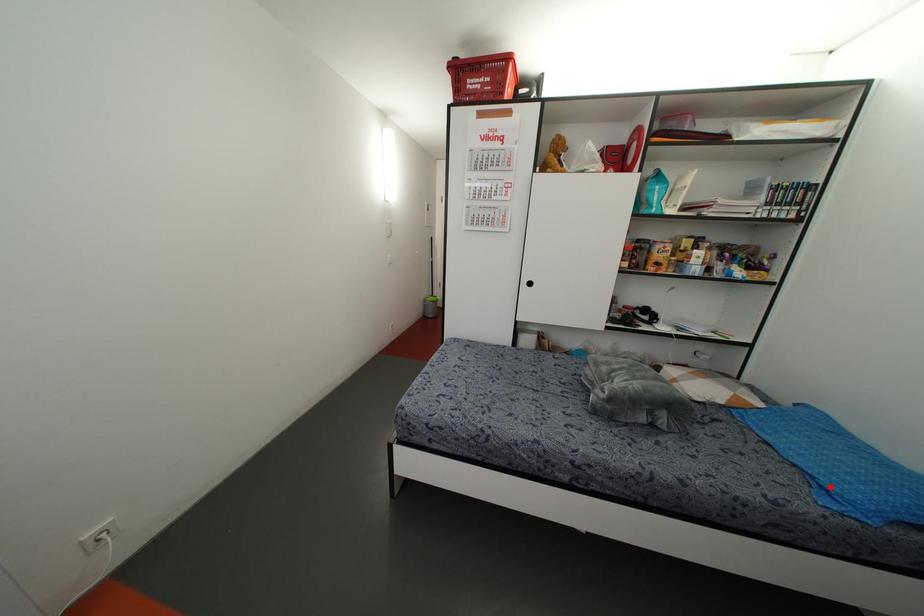
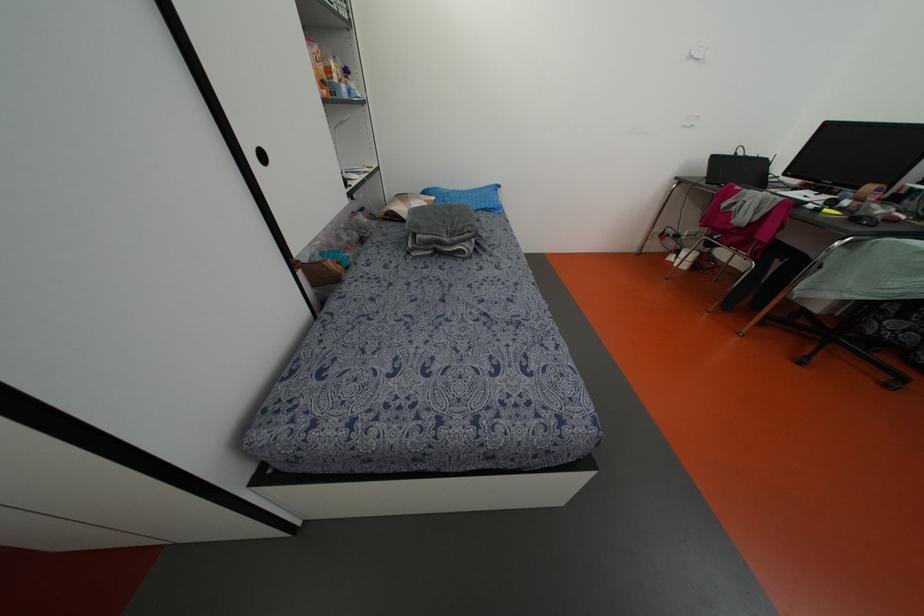
The point at the highlighted location is marked in the first image. Where is the corresponding point in the second image?

(492, 206)